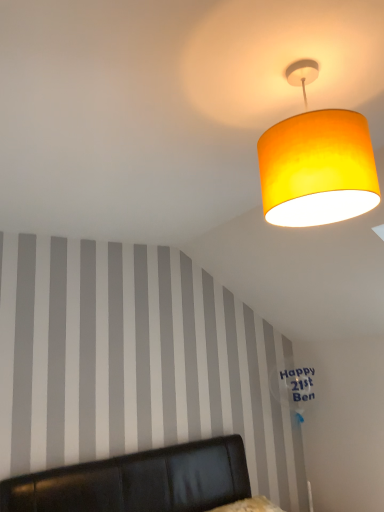
What do you see at coordinates (139, 481) in the screenshot?
I see `black leather headboard at lower center` at bounding box center [139, 481].

The image size is (384, 512). I want to click on black leather headboard at lower center, so click(x=139, y=481).

I want to click on matte yellow fabric lampshade at upper right, so click(316, 163).

This screenshot has height=512, width=384. Describe the element at coordinates (316, 163) in the screenshot. I see `matte yellow fabric lampshade at upper right` at that location.

Measure the distance between matte yellow fabric lampshade at upper right and camera.

matte yellow fabric lampshade at upper right is 36.76 inches away from camera.

The height and width of the screenshot is (512, 384). Identify the location of black leather headboard at lower center. (139, 481).

Between black leather headboard at lower center and matte yellow fabric lampshade at upper right, which one appears on the right side from the viewer's perspective?

matte yellow fabric lampshade at upper right.

In the image, is black leather headboard at lower center positioned in front of or behind matte yellow fabric lampshade at upper right?

black leather headboard at lower center is positioned closer to the viewer than matte yellow fabric lampshade at upper right.

Is point (199, 450) closer to camera compared to point (327, 129)?

No, (199, 450) is further to viewer.

In the scene shown: From the image's perspective, is black leather headboard at lower center located above or below matte yellow fabric lampshade at upper right?

black leather headboard at lower center is below matte yellow fabric lampshade at upper right.

From a real-world perspective, which object rests below the other?

black leather headboard at lower center.

In the scene shown: Looking at their sizes, would you say black leather headboard at lower center is wider or thinner than matte yellow fabric lampshade at upper right?

Clearly, black leather headboard at lower center has more width compared to matte yellow fabric lampshade at upper right.

Between black leather headboard at lower center and matte yellow fabric lampshade at upper right, which one has less height?

matte yellow fabric lampshade at upper right.

Is black leather headboard at lower center bigger than matte yellow fabric lampshade at upper right?

Yes, black leather headboard at lower center is bigger than matte yellow fabric lampshade at upper right.

Is black leather headboard at lower center located outside matte yellow fabric lampshade at upper right?

Yes, black leather headboard at lower center is not within matte yellow fabric lampshade at upper right.

Is there a large distance between black leather headboard at lower center and matte yellow fabric lampshade at upper right?

Indeed, black leather headboard at lower center is not near matte yellow fabric lampshade at upper right.

Is black leather headboard at lower center facing away from matte yellow fabric lampshade at upper right?

No, black leather headboard at lower center is not facing away from matte yellow fabric lampshade at upper right.

Measure the distance between black leather headboard at lower center and matte yellow fabric lampshade at upper right.

black leather headboard at lower center is 1.93 meters from matte yellow fabric lampshade at upper right.

Find the location of `lamp above the black leather headboard at lower center (from a real-world perspective)`. lamp above the black leather headboard at lower center (from a real-world perspective) is located at coordinates (316, 163).

Considering the positions of objects matte yellow fabric lampshade at upper right and black leather headboard at lower center in the image provided, who is more to the right, matte yellow fabric lampshade at upper right or black leather headboard at lower center?

matte yellow fabric lampshade at upper right is more to the right.

Does matte yellow fabric lampshade at upper right lie in front of black leather headboard at lower center?

No, the depth of matte yellow fabric lampshade at upper right is greater than that of black leather headboard at lower center.

Does point (309, 71) appear closer or farther from the camera than point (241, 465)?

Point (309, 71) is closer to the camera than point (241, 465).

From the image's perspective, who appears lower, matte yellow fabric lampshade at upper right or black leather headboard at lower center?

black leather headboard at lower center.

Consider the image. From a real-world perspective, who is located lower, matte yellow fabric lampshade at upper right or black leather headboard at lower center?

black leather headboard at lower center, from a real-world perspective.

Considering the relative sizes of matte yellow fabric lampshade at upper right and black leather headboard at lower center in the image provided, is matte yellow fabric lampshade at upper right thinner than black leather headboard at lower center?

Yes.

Can you confirm if matte yellow fabric lampshade at upper right is shorter than black leather headboard at lower center?

Indeed, matte yellow fabric lampshade at upper right has a lesser height compared to black leather headboard at lower center.

Looking at this image, considering the sizes of matte yellow fabric lampshade at upper right and black leather headboard at lower center in the image, is matte yellow fabric lampshade at upper right bigger or smaller than black leather headboard at lower center?

Clearly, matte yellow fabric lampshade at upper right is smaller in size than black leather headboard at lower center.

Is matte yellow fabric lampshade at upper right spatially inside black leather headboard at lower center, or outside of it?

matte yellow fabric lampshade at upper right exists outside the volume of black leather headboard at lower center.

Is matte yellow fabric lampshade at upper right far from black leather headboard at lower center?

Yes, matte yellow fabric lampshade at upper right and black leather headboard at lower center are located far from each other.

Could you tell me if matte yellow fabric lampshade at upper right is facing black leather headboard at lower center?

No.

At what (x,y) coordinates should I click in order to perform the action: click on furniture below the matte yellow fabric lampshade at upper right (from a real-world perspective). Please return your answer as a coordinate pair (x, y). The width and height of the screenshot is (384, 512). Looking at the image, I should click on coord(139,481).

I want to click on furniture in front of the matte yellow fabric lampshade at upper right, so click(139, 481).

Where is `lamp located above the black leather headboard at lower center (from a real-world perspective)`? lamp located above the black leather headboard at lower center (from a real-world perspective) is located at coordinates (316, 163).